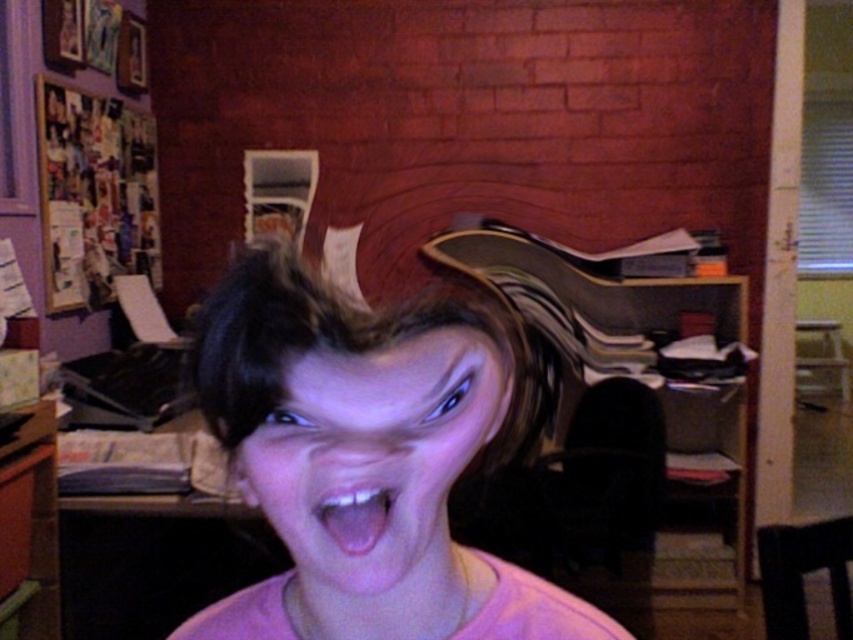
Who is shorter, pink matte hair at center or pink glossy tongue at center?

pink glossy tongue at center is shorter.

In the scene shown: Which is more to the right, pink matte hair at center or pink glossy tongue at center?

From the viewer's perspective, pink matte hair at center appears more on the right side.

Who is more forward, [224,444] or [321,515]?

Positioned in front is point [321,515].

Where is `pink matte hair at center`? pink matte hair at center is located at coordinates (370, 454).

Consider the image. Can you confirm if pink matte hair at center is taller than pink matte face at center?

Correct, pink matte hair at center is much taller as pink matte face at center.

Can you confirm if pink matte hair at center is smaller than pink matte face at center?

Actually, pink matte hair at center might be larger than pink matte face at center.

Describe the element at coordinates (370, 454) in the screenshot. The width and height of the screenshot is (853, 640). I see `pink matte hair at center` at that location.

The image size is (853, 640). I want to click on pink matte hair at center, so click(x=370, y=454).

Is pink matte face at center smaller than pink glossy tongue at center?

No, pink matte face at center is not smaller than pink glossy tongue at center.

The image size is (853, 640). I want to click on pink matte face at center, so coord(376,465).

The image size is (853, 640). I want to click on pink matte face at center, so click(x=376, y=465).